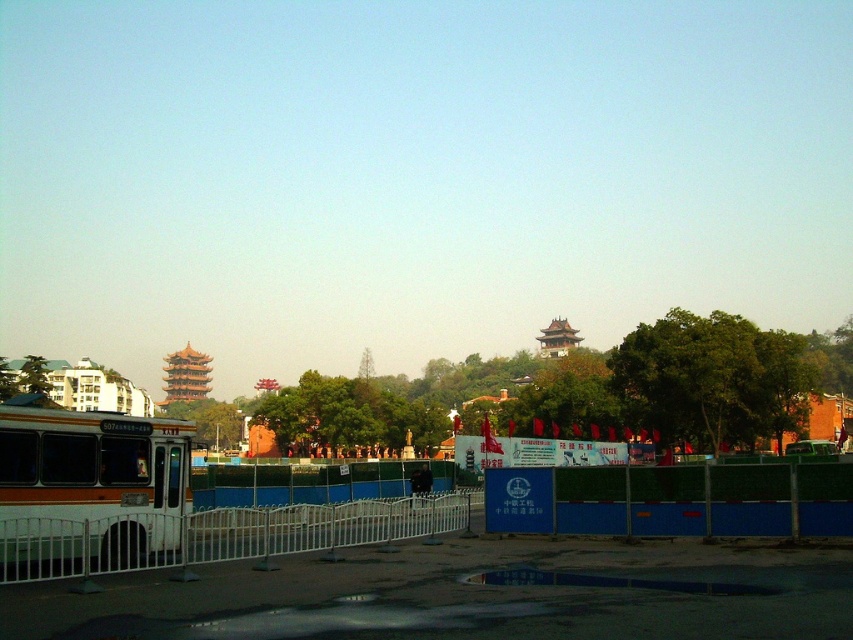
You are standing at the construction site entrance and want to reach the point marked as point (662, 486). To do this, you must first pass through point (331, 548). Is this path possible?

Yes, because point (662, 486) is behind point (331, 548), so you must pass through point (331, 548) first to reach it.

You are a pedestrian standing at the edge of the paved area. You see the blue fabric fence at center and the white metal fence at lower left. Which fence is higher up in the image?

The blue fabric fence at center is above the white metal fence at lower left, so the blue fabric fence at center is higher up in the image.